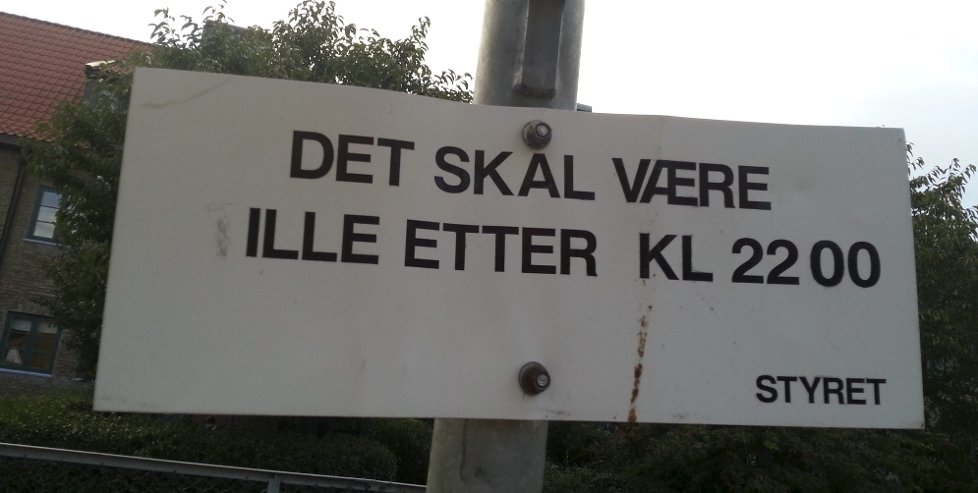
Where is `window`? window is located at coordinates (32, 226), (15, 348).